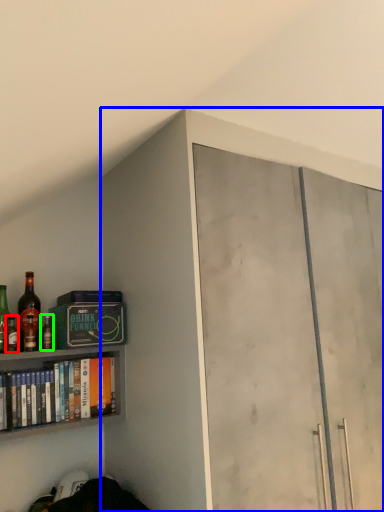
Question: Based on their relative distances, which object is nearer to bottle (highlighted by a red box)? Choose from cabinetry (highlighted by a blue box) and bottle (highlighted by a green box).

Choices:
 (A) cabinetry
 (B) bottle

Answer: (B)